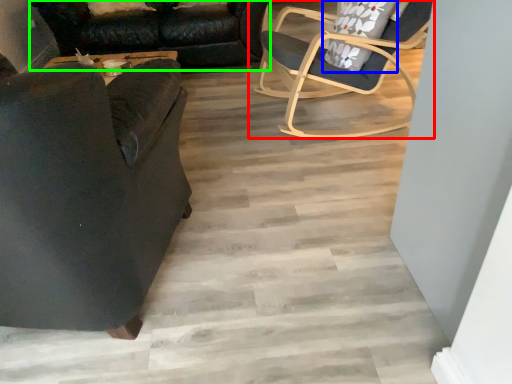
Question: Considering the real-world distances, which object is farthest from chair (highlighted by a red box)? pillow (highlighted by a blue box) or studio couch (highlighted by a green box)?

Choices:
 (A) pillow
 (B) studio couch

Answer: (B)